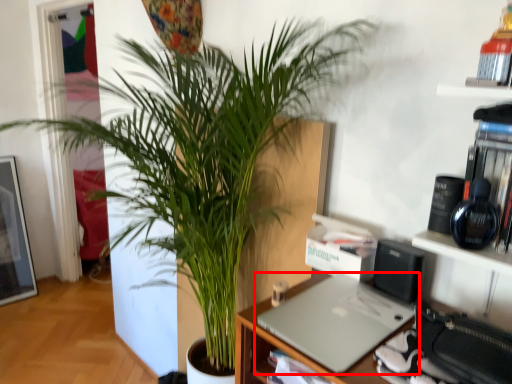
Question: Observing the image, what is the correct spatial positioning of laptop (annotated by the red box) in reference to houseplant?

Choices:
 (A) right
 (B) left

Answer: (A)